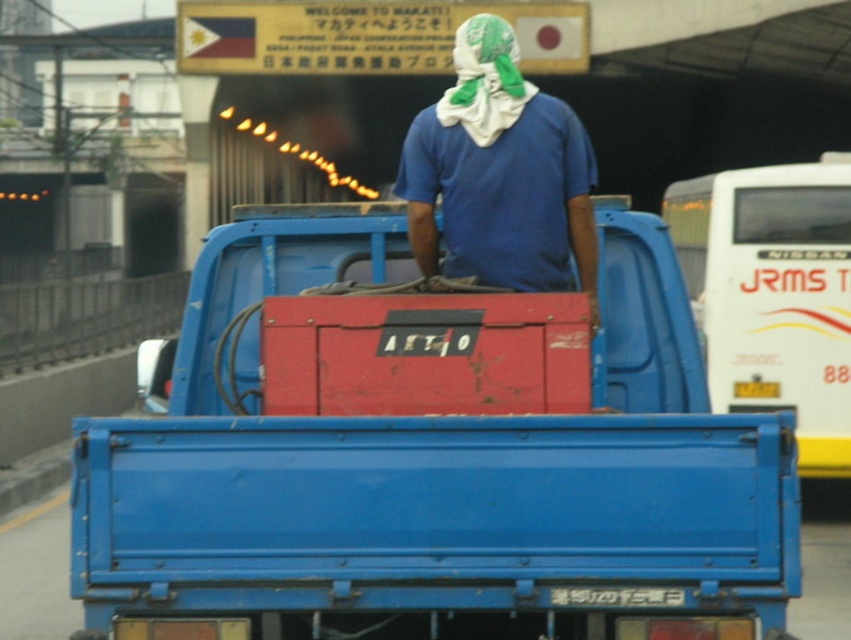
Question: Which point is farther from the camera taking this photo?

Choices:
 (A) (684, 476)
 (B) (789, 237)
 (C) (477, 81)
 (D) (500, 20)

Answer: (B)

Question: Can you confirm if matte red toolbox at center is wider than green cotton headscarf at upper center?

Choices:
 (A) no
 (B) yes

Answer: (B)

Question: Among these objects, which one is nearest to the camera?

Choices:
 (A) blue cotton shirt at center
 (B) blue plastic truck at right
 (C) matte red toolbox at center
 (D) green cotton headscarf at upper center

Answer: (C)

Question: Which of the following is the farthest from the observer?

Choices:
 (A) matte red toolbox at center
 (B) green cotton headscarf at upper center

Answer: (B)

Question: Does blue plastic truck at right lie in front of blue cotton shirt at center?

Choices:
 (A) yes
 (B) no

Answer: (A)

Question: From the image, what is the correct spatial relationship of blue cotton shirt at center in relation to green cotton headscarf at upper center?

Choices:
 (A) left
 (B) right

Answer: (B)